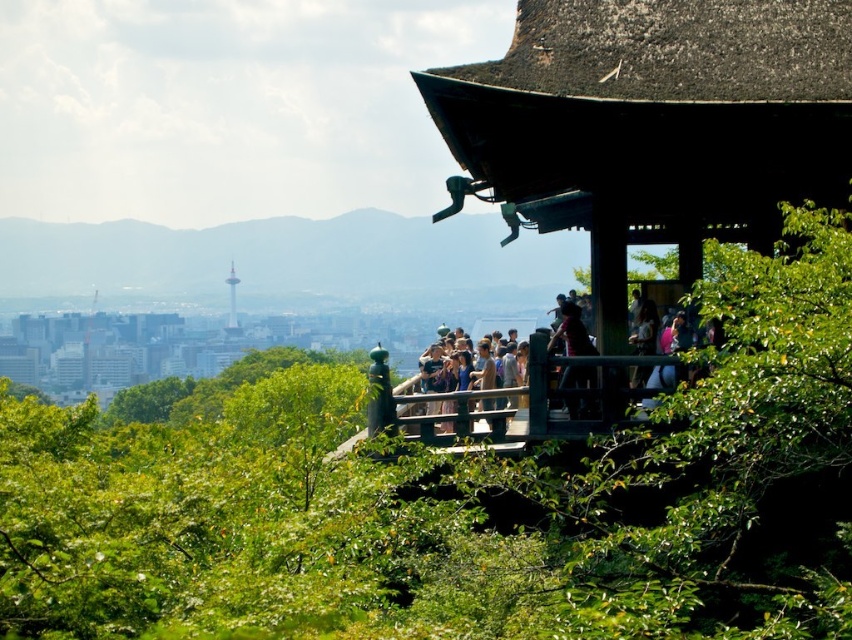
Does green leafy trees at center have a lesser height compared to green leafy mountain at upper left?

Correct, green leafy trees at center is not as tall as green leafy mountain at upper left.

Is green leafy trees at center further to the viewer compared to green leafy mountain at upper left?

No, green leafy trees at center is in front of green leafy mountain at upper left.

Between point (186, 429) and point (314, 220), which one is positioned in front?

Point (186, 429) is in front.

Image resolution: width=852 pixels, height=640 pixels. I want to click on green leafy trees at center, so click(x=461, y=496).

Does green leafy mountain at upper left have a lesser width compared to multicolored casual clothing at center?

In fact, green leafy mountain at upper left might be wider than multicolored casual clothing at center.

Is point (531, 282) positioned after point (514, 397)?

Yes, point (531, 282) is behind point (514, 397).

Is point (13, 221) closer to camera compared to point (440, 362)?

No, it is behind (440, 362).

At what (x,y) coordinates should I click in order to perform the action: click on green leafy mountain at upper left. Please return your answer as a coordinate pair (x, y). Looking at the image, I should click on (283, 260).

Can you confirm if green leafy trees at center is bigger than multicolored casual clothing at center?

Yes, green leafy trees at center is bigger than multicolored casual clothing at center.

Is green leafy trees at center behind multicolored casual clothing at center?

No.

The image size is (852, 640). I want to click on green leafy trees at center, so click(461, 496).